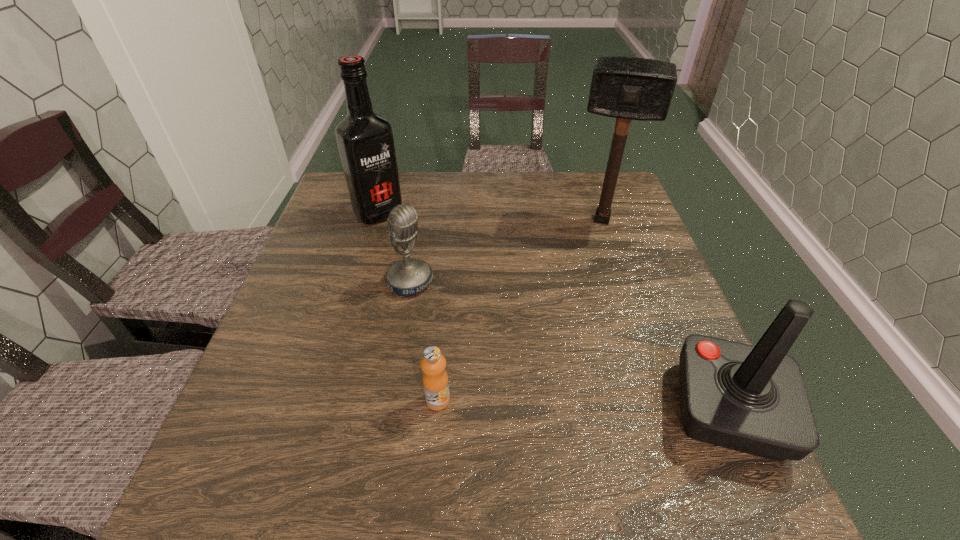
Where is `free space between the third shortest object and the liquor`? free space between the third shortest object and the liquor is located at coordinates (554, 312).

This screenshot has width=960, height=540. Identify the location of free space that is in between the third shortest object and the microphone. (569, 346).

I want to click on vacant space that is in between the third tallest object and the microphone, so point(569,346).

Where is `unoccupied position between the joystick and the third farthest object`? unoccupied position between the joystick and the third farthest object is located at coordinates (569, 346).

This screenshot has width=960, height=540. Find the location of `object that stands as the closest to the orange juice`. object that stands as the closest to the orange juice is located at coordinates (407, 277).

Point out which object is positioned as the nearest to the liquor. Please provide its 2D coordinates. Your answer should be formatted as a tuple, i.e. [(x, y)], where the tuple contains the x and y coordinates of a point satisfying the conditions above.

[(407, 277)]

Identify the location of blank area in the image that satisfies the following two spatial constraints: 1. on the front label of the orange juice; 2. on the left side of the third shortest object. The image size is (960, 540). (437, 410).